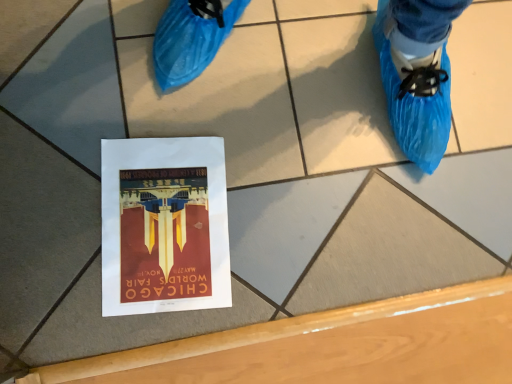
At what (x,y) coordinates should I click in order to perform the action: click on free space in front of matte paper poster at center. Please return your answer as a coordinate pair (x, y). Image resolution: width=512 pixels, height=384 pixels. Looking at the image, I should click on [77, 306].